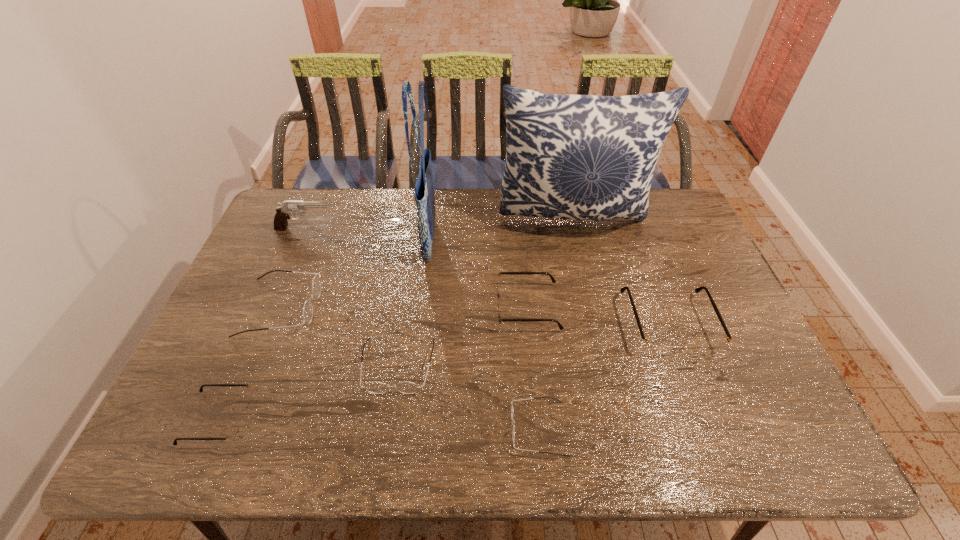
Where is `free space that satisfies the following two spatial constraints: 1. on the front surface of the cushion; 2. at the muzzle of the gun`? free space that satisfies the following two spatial constraints: 1. on the front surface of the cushion; 2. at the muzzle of the gun is located at coordinates (576, 229).